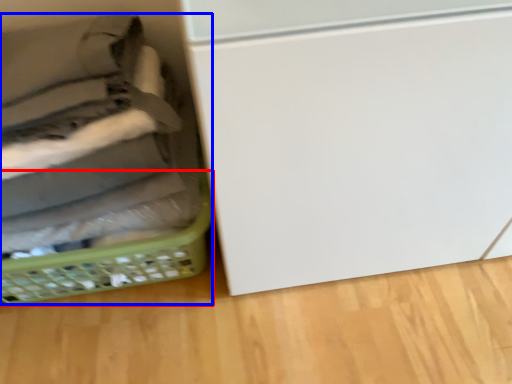
Question: Which of the following is the closest to the observer, basket (highlighted by a red box) or basket (highlighted by a blue box)?

Choices:
 (A) basket
 (B) basket

Answer: (B)